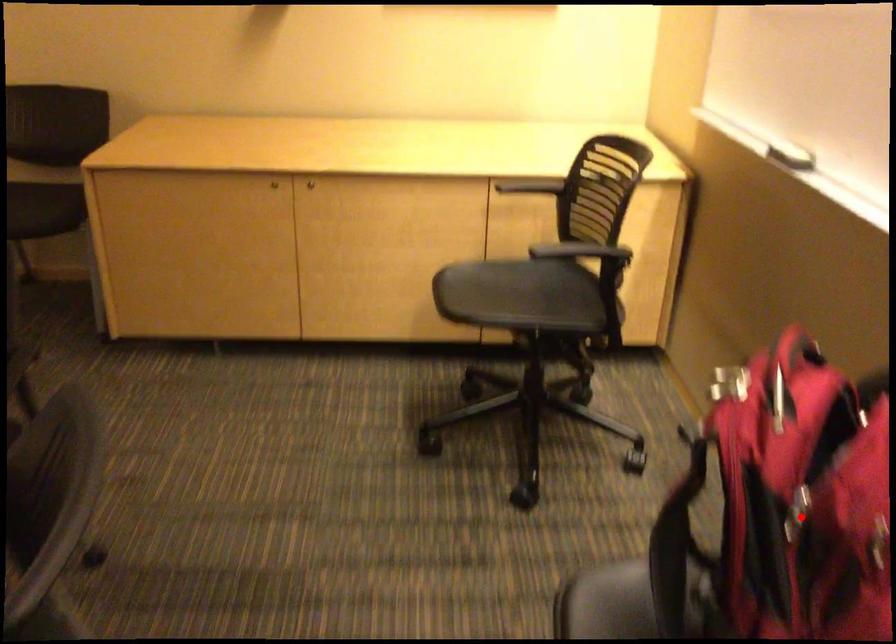
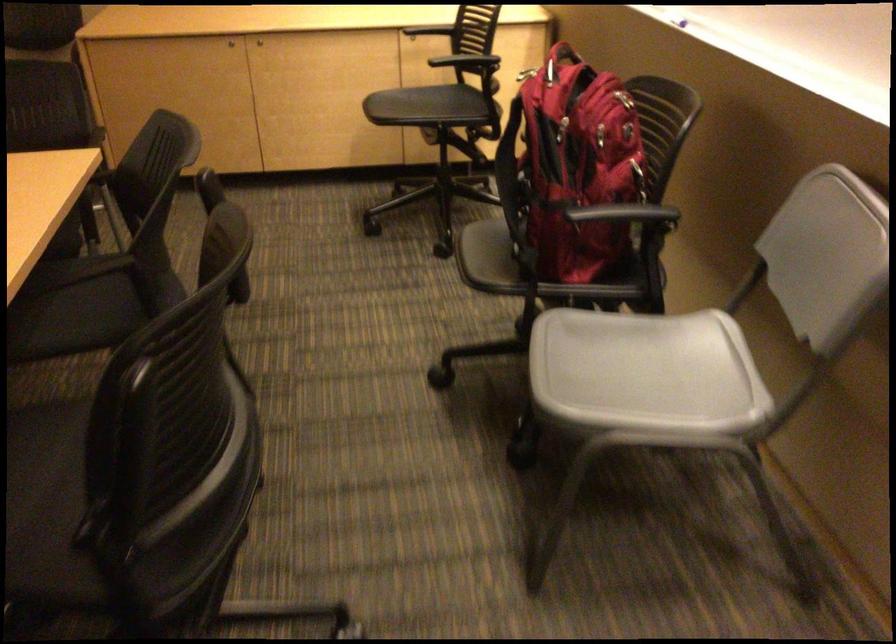
Locate, in the second image, the point that corresponds to the highlighted location in the first image.

(564, 127)